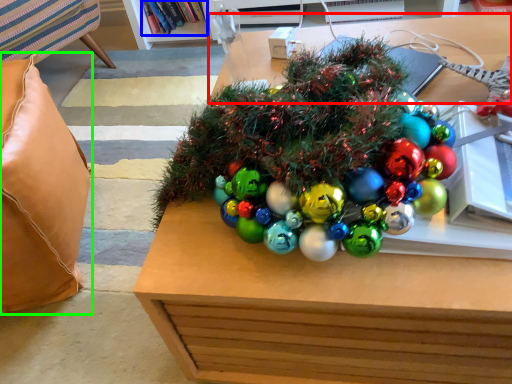
Question: Based on their relative distances, which object is nearer to table (highlighted by a red box)? Choose from book (highlighted by a blue box) and pillow (highlighted by a green box).

Choices:
 (A) book
 (B) pillow

Answer: (B)